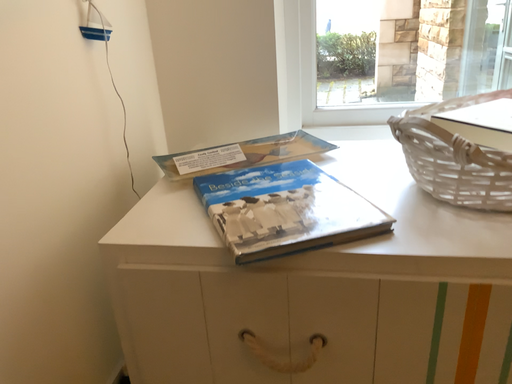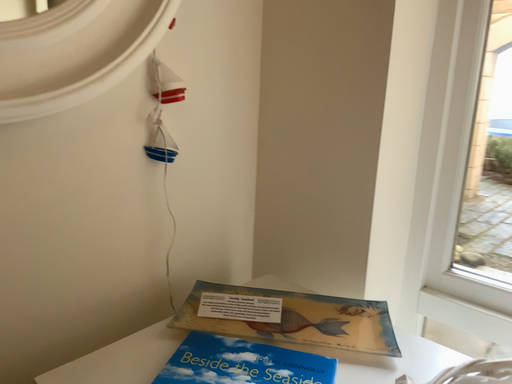
Question: Which way did the camera rotate in the video?

Choices:
 (A) rotated downward
 (B) rotated upward

Answer: (B)